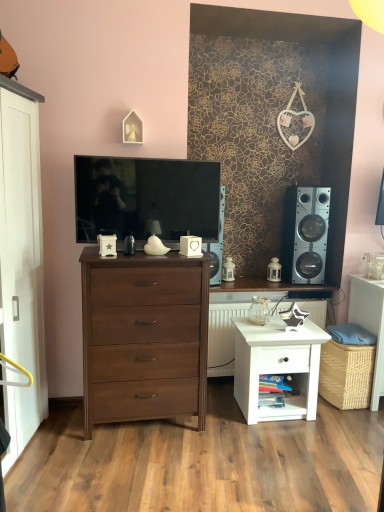
This screenshot has width=384, height=512. Identify the location of vacant region to the right of dark wood chest of drawers at center. (230, 436).